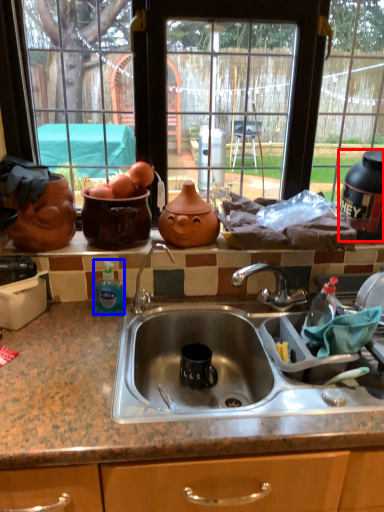
Question: Which point is closer to the camera, appliance (highlighted by a red box) or bottle (highlighted by a blue box)?

Choices:
 (A) appliance
 (B) bottle

Answer: (B)